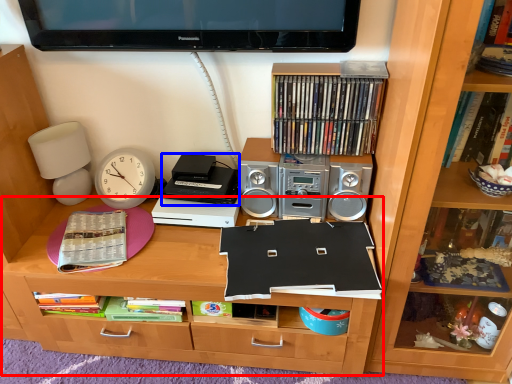
Question: Which point is further to the camera, desk (highlighted by a red box) or cassette (highlighted by a blue box)?

Choices:
 (A) desk
 (B) cassette

Answer: (B)